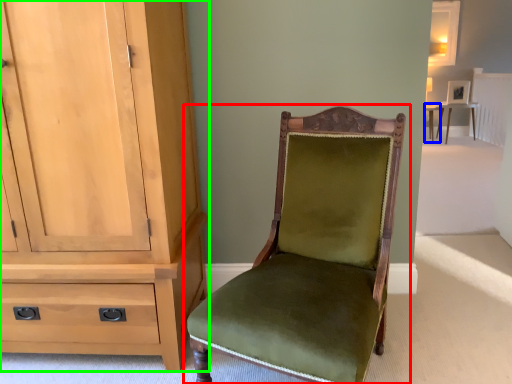
Question: Which object is positioned closest to chair (highlighted by a red box)? Select from table (highlighted by a blue box) and cabinetry (highlighted by a green box).

Choices:
 (A) table
 (B) cabinetry

Answer: (B)